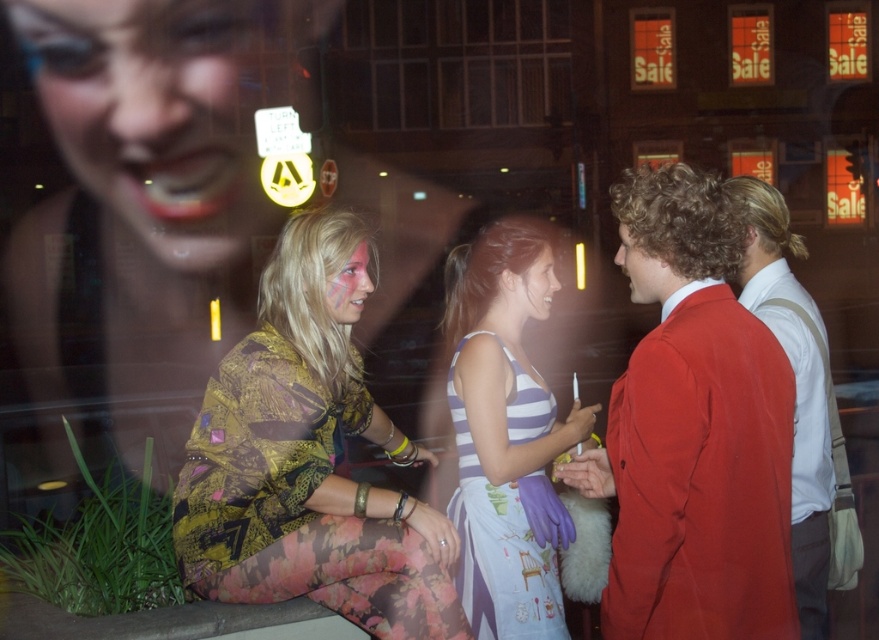
Is matte red suit at right smaller than matte red blazer at right?

Yes.

Is matte red suit at right taller than matte red blazer at right?

No.

Measure the distance between matte red suit at right and camera.

matte red suit at right is 9.26 feet away from camera.

I want to click on matte red suit at right, so click(x=695, y=435).

Between point (323, 452) and point (498, 317), which one is positioned in front?

Point (323, 452)

Does floral-patterned dress at center appear on the right side of striped fabric dress at center?

Incorrect, floral-patterned dress at center is not on the right side of striped fabric dress at center.

The image size is (879, 640). I want to click on floral-patterned dress at center, so click(x=309, y=465).

Image resolution: width=879 pixels, height=640 pixels. Find the location of `floral-patterned dress at center`. floral-patterned dress at center is located at coordinates (309, 465).

Does matte red suit at right lie behind matte pink paint at center?

No.

Is matte red suit at right wider than matte pink paint at center?

Yes.

Which is behind, point (689, 410) or point (332, 301)?

Positioned behind is point (332, 301).

Where is `matte red suit at right`? The image size is (879, 640). matte red suit at right is located at coordinates (695, 435).